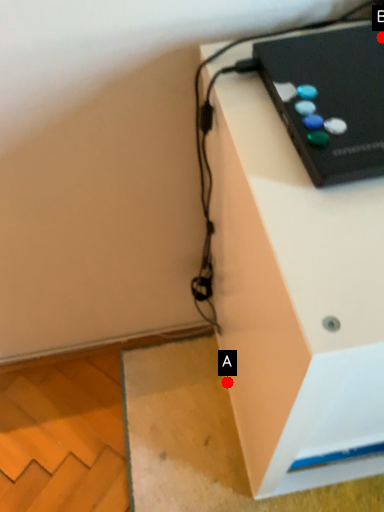
Question: Two points are circled on the image, labeled by A and B beside each circle. Among these points, which one is nearest to the camera?

Choices:
 (A) A is closer
 (B) B is closer

Answer: (B)